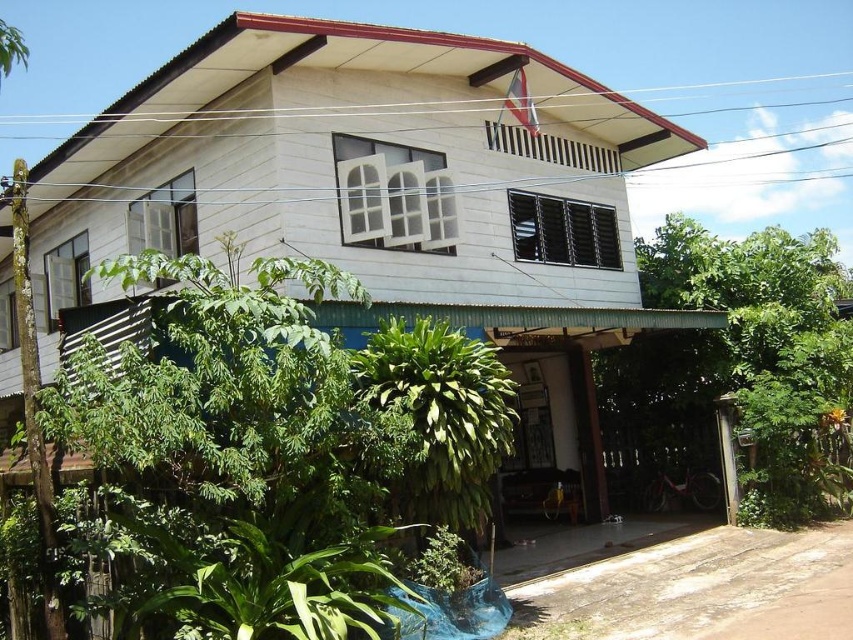
Question: Among these objects, which one is nearest to the camera?

Choices:
 (A) green leafy plant at left
 (B) green leafy plant at lower right
 (C) green leafy plant at lower center

Answer: (A)

Question: Which object appears closest to the camera in this image?

Choices:
 (A) green leafy plant at left
 (B) green leafy plant at lower center

Answer: (A)

Question: Is green leafy plant at left above green leafy plant at lower center?

Choices:
 (A) yes
 (B) no

Answer: (B)

Question: Is green leafy plant at left positioned at the back of green leafy plant at lower right?

Choices:
 (A) no
 (B) yes

Answer: (A)

Question: Which object appears closest to the camera in this image?

Choices:
 (A) green leafy plant at lower right
 (B) green leafy plant at left

Answer: (B)

Question: Is green leafy plant at left to the left of green leafy plant at lower right from the viewer's perspective?

Choices:
 (A) yes
 (B) no

Answer: (A)